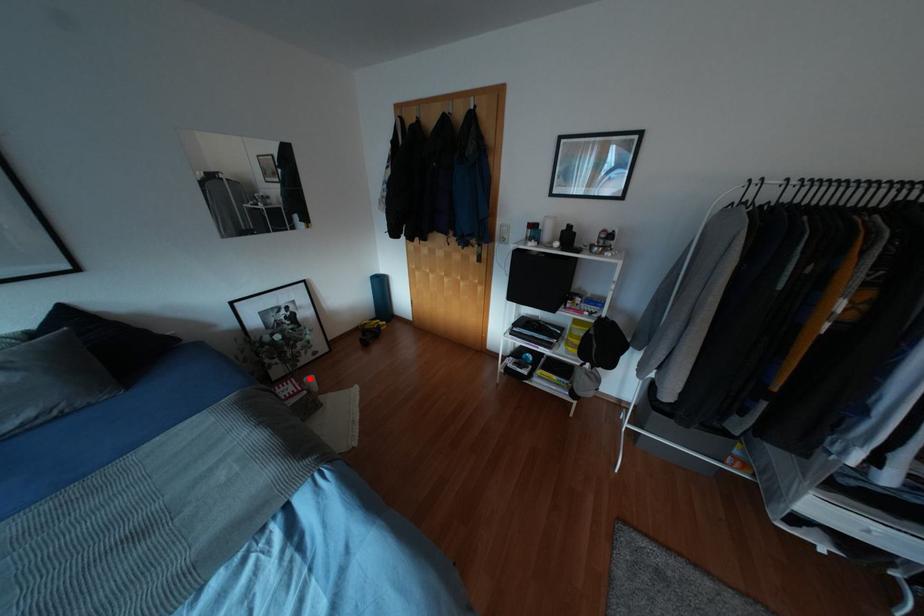
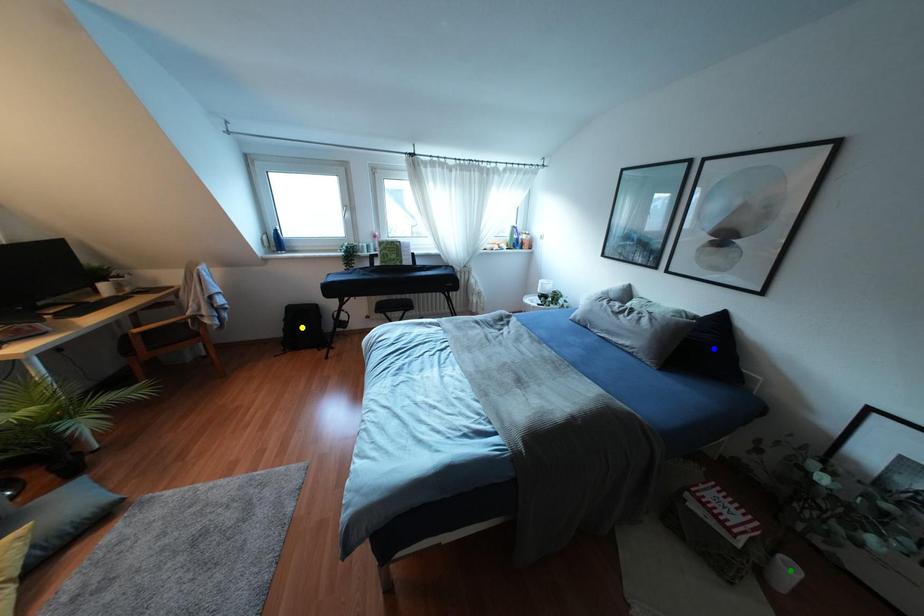
Question: I am providing you with two images of the same scene from different viewpoints. A red point is marked on the first image. You are given multiple points on the second image. Which spot in image 2 lines up with the point in image 1?

Choices:
 (A) yellow point
 (B) green point
 (C) blue point

Answer: (B)